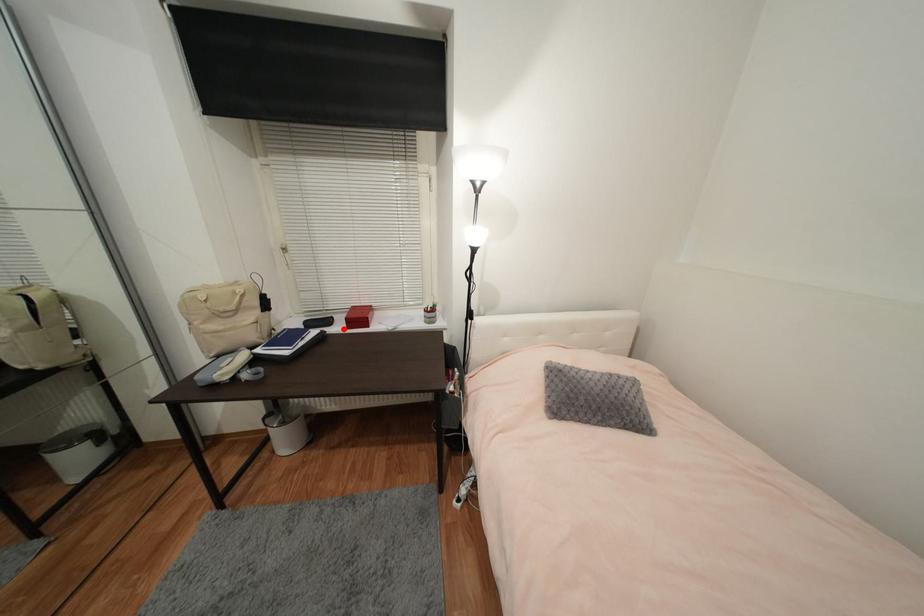
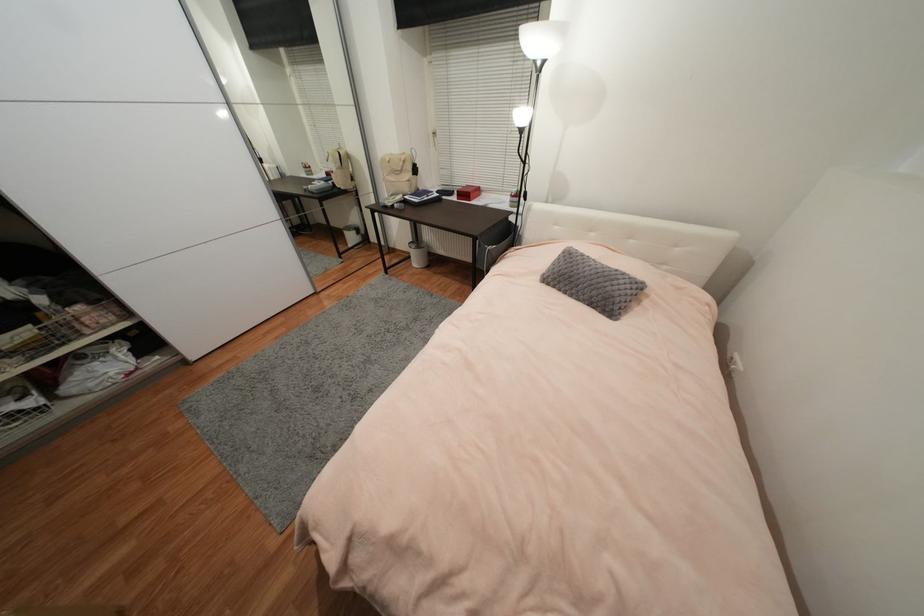
Question: I am providing you with two images of the same scene from different viewpoints. A red point is marked on the first image. Is the red point's position out of view in image 2?

Choices:
 (A) Yes
 (B) No

Answer: (B)